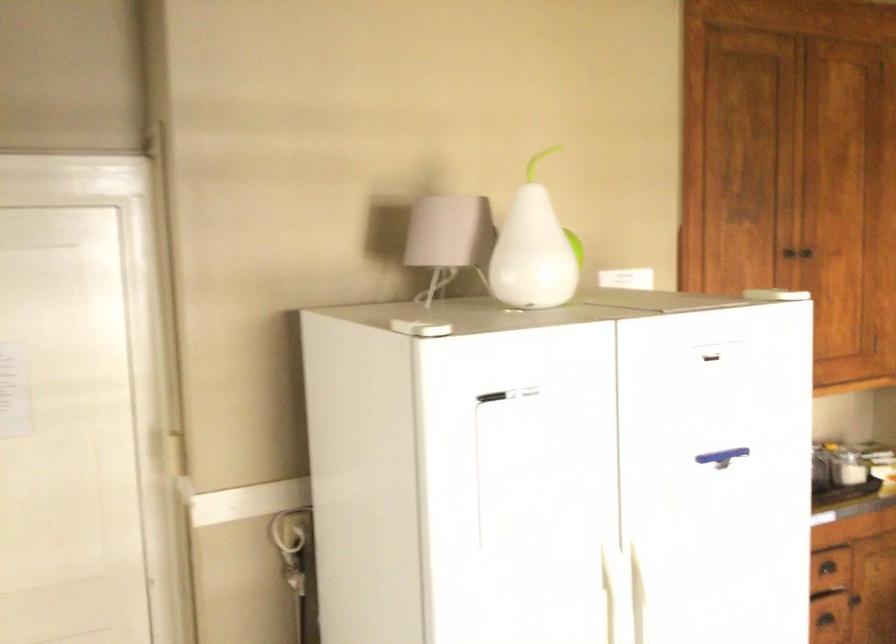
The location [449,239] corresponds to which object?

It corresponds to the small grey lamp in the image.